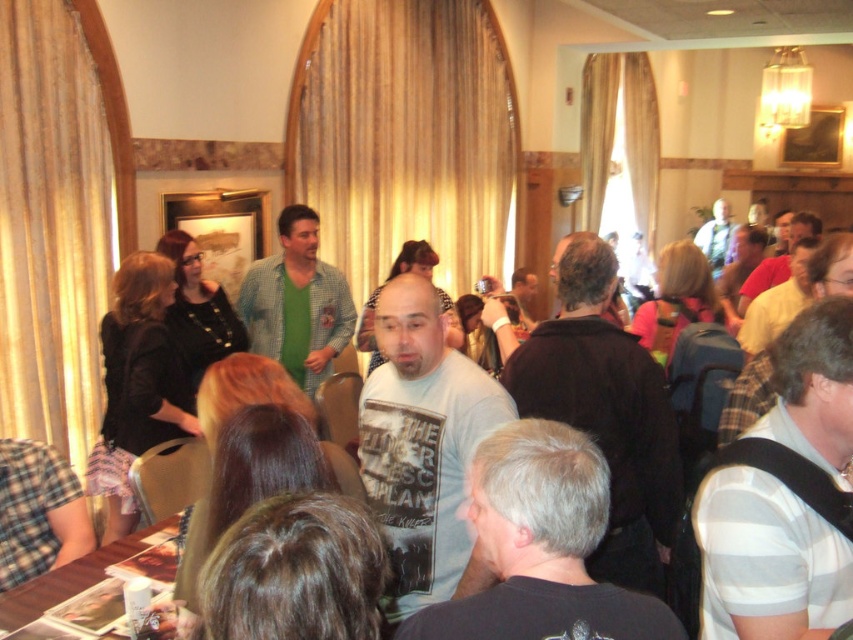
Can you confirm if wooden table at lower left is positioned below white t-shirt at center?

Incorrect, wooden table at lower left is not positioned below white t-shirt at center.

Which is more to the left, wooden table at lower left or white t-shirt at center?

Positioned to the left is wooden table at lower left.

Is point (177, 515) positioned before point (4, 618)?

No, (177, 515) is behind (4, 618).

Find the location of a particular element. This screenshot has width=853, height=640. wooden table at lower left is located at coordinates [70, 579].